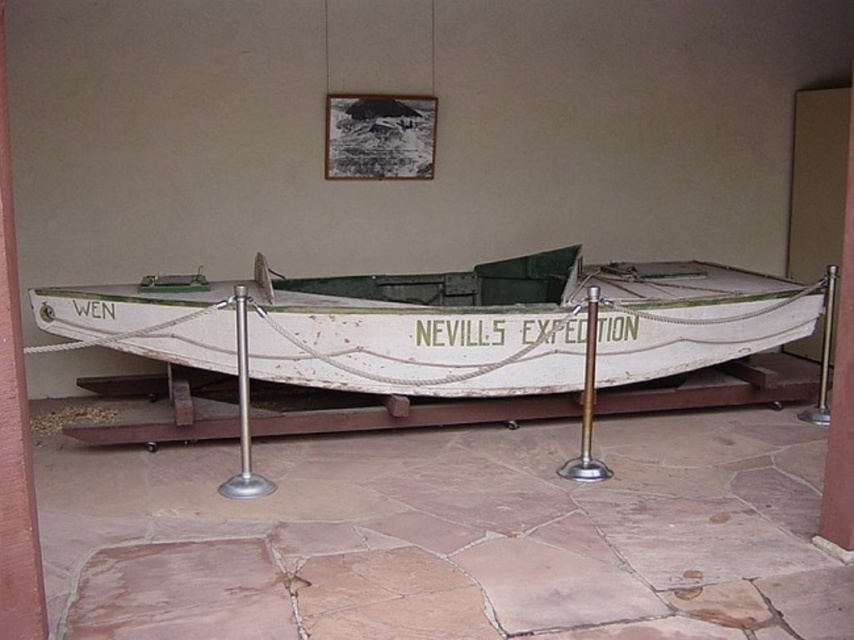
You are a museum visitor holding a 1.5 meter long measuring tape. You want to measure the distance between the white wooden boat at center and the silver metallic pole at center. Can you do this without moving any objects?

The white wooden boat at center is 1.83 meters away from the silver metallic pole at center, so yes, you can measure the distance using your 1.5 meter measuring tape by extending it fully and noting that the distance is longer than the tape, requiring an additional 0.33 meters.

You are a visitor at the museum and want to take a photo of the white wooden boat at center. The silver metallic pole at center is blocking your view. Can you estimate whether the boat is shorter or taller than the pole to decide if you can move closer without tripping over it?

The white wooden boat at center is shorter than the silver metallic pole at center, so you can move closer to avoid tripping over the pole while taking the photo.